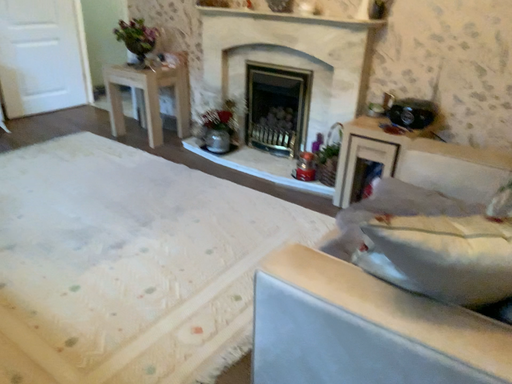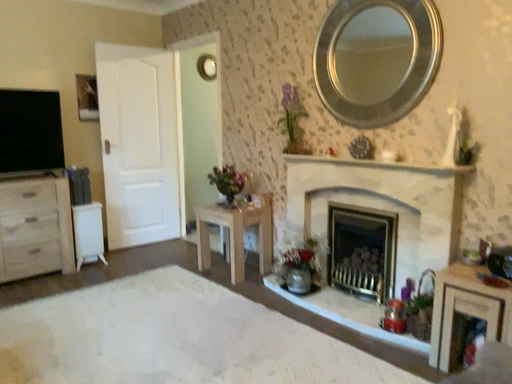
Question: Which way did the camera rotate in the video?

Choices:
 (A) rotated upward
 (B) rotated downward

Answer: (A)